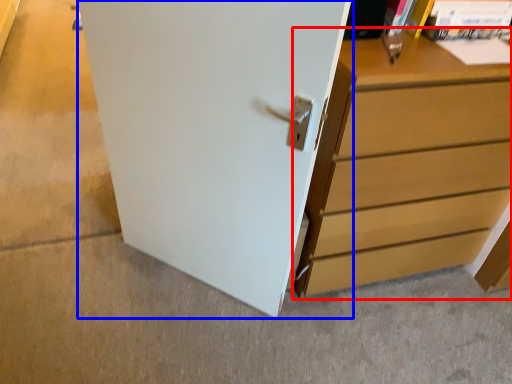
Question: Among these objects, which one is nearest to the camera, chest of drawers (highlighted by a red box) or door (highlighted by a blue box)?

Choices:
 (A) chest of drawers
 (B) door

Answer: (B)